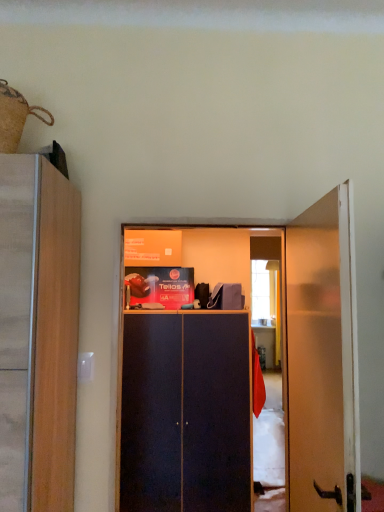
Question: Considering their positions, is wooden door at right located in front of or behind burlap sack at upper left?

Choices:
 (A) behind
 (B) front

Answer: (B)

Question: From a real-world perspective, is wooden door at right positioned above or below burlap sack at upper left?

Choices:
 (A) below
 (B) above

Answer: (A)

Question: Which object is the farthest from the dark wood cabinet at center?

Choices:
 (A) burlap sack at upper left
 (B) wooden door at right

Answer: (A)

Question: Based on their relative distances, which object is farther from the burlap sack at upper left?

Choices:
 (A) wooden door at right
 (B) dark wood cabinet at center

Answer: (B)